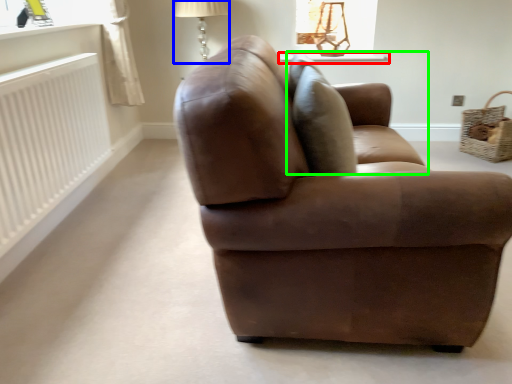
Question: Estimate the real-world distances between objects in this image. Which object is closer to window sill (highlighted by a red box), table lamp (highlighted by a blue box) or swivel chair (highlighted by a green box)?

Choices:
 (A) table lamp
 (B) swivel chair

Answer: (A)